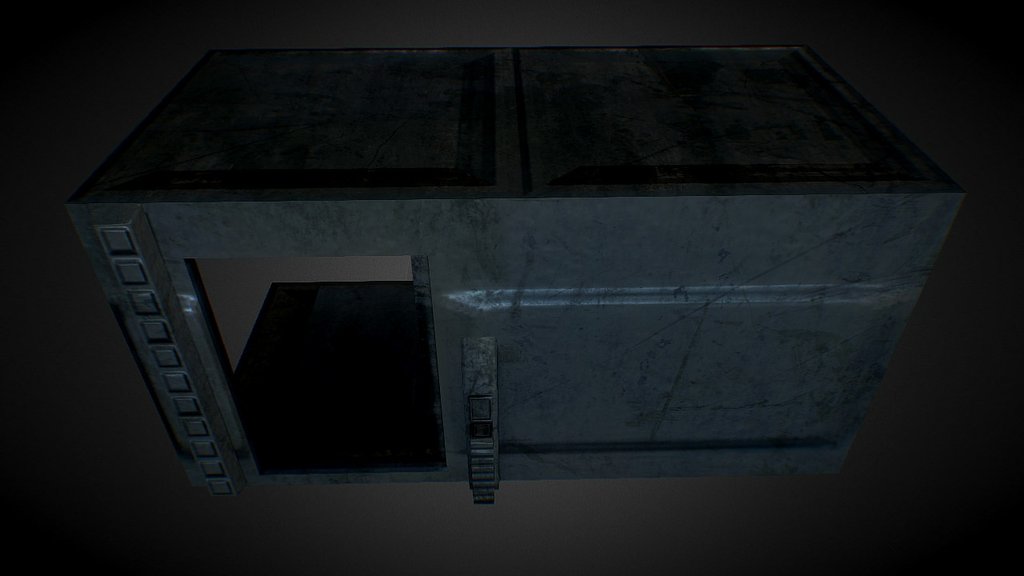
Identify the location of corner. (995, 559), (19, 560), (25, 60), (993, 22).